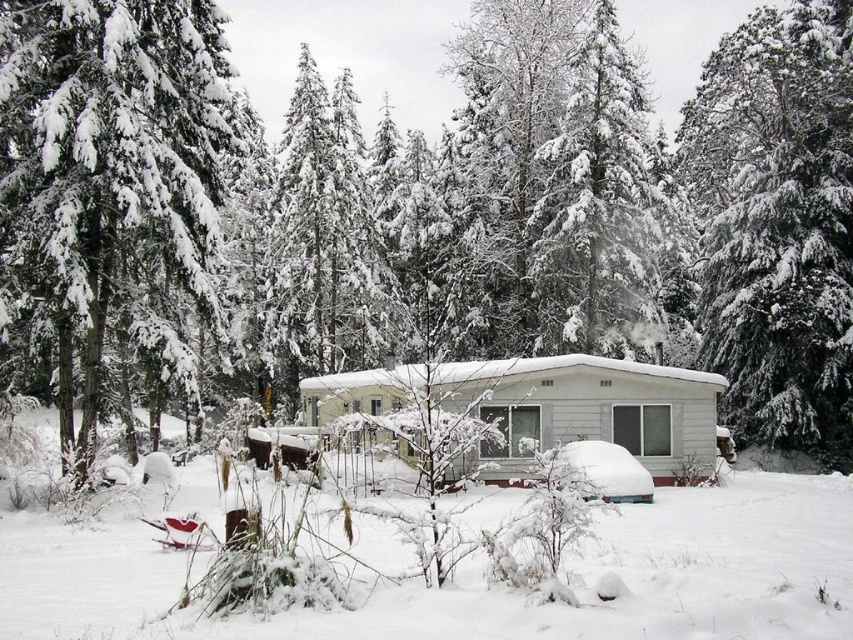
Can you confirm if snow-covered evergreen at left is thinner than white fluffy snow at center?

Yes, snow-covered evergreen at left is thinner than white fluffy snow at center.

Is point (128, 353) closer to camera compared to point (761, 609)?

No, (128, 353) is further to viewer.

Who is more distant from viewer, (189, 33) or (129, 616)?

The point (189, 33) is more distant.

Identify the location of snow-covered evergreen at left. (112, 205).

Who is more distant from viewer, (775, 483) or (572, 298)?

Positioned behind is point (572, 298).

Is point (821, 566) farther from viewer compared to point (596, 93)?

That is False.

Who is more distant from viewer, (131, 580) or (601, 77)?

Point (601, 77)

At what (x,y) coordinates should I click in order to perform the action: click on white fluffy snow at center. Please return your answer as a coordinate pair (x, y). This screenshot has height=640, width=853. Looking at the image, I should click on (485, 579).

From the picture: Is white fluffy snow at center shorter than white matte cabin at center?

Yes.

Measure the distance between point (x=809, y=476) and camera.

They are 23.37 meters apart.

You are a GUI agent. You are given a task and a screenshot of the screen. Output one action in this format:
    pyautogui.click(x=<x>, y=<y>)
    Task: Click on the white fluffy snow at center
    
    Given the screenshot: What is the action you would take?
    pyautogui.click(x=485, y=579)